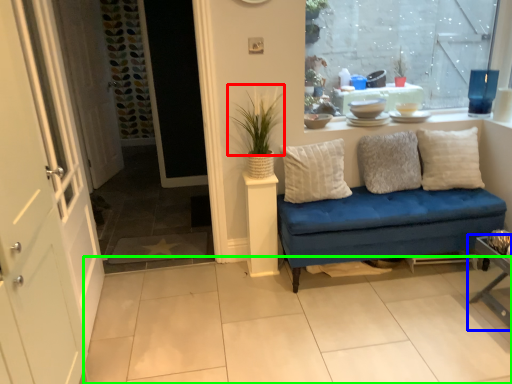
Question: Which is nearer to the plant (highlighted by a red box)? table (highlighted by a blue box) or tile (highlighted by a green box).

Choices:
 (A) table
 (B) tile

Answer: (B)